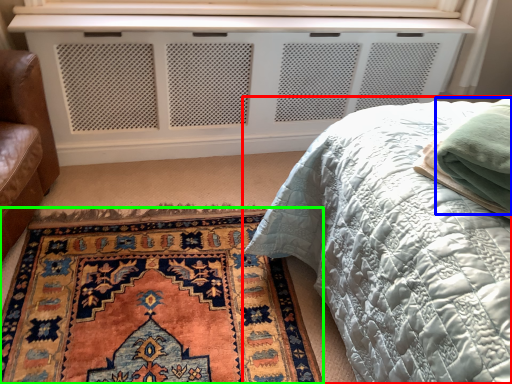
Question: Which object is the closest to the bed (highlighted by a red box)? Choose among these: material (highlighted by a blue box) or mat (highlighted by a green box).

Choices:
 (A) material
 (B) mat

Answer: (A)